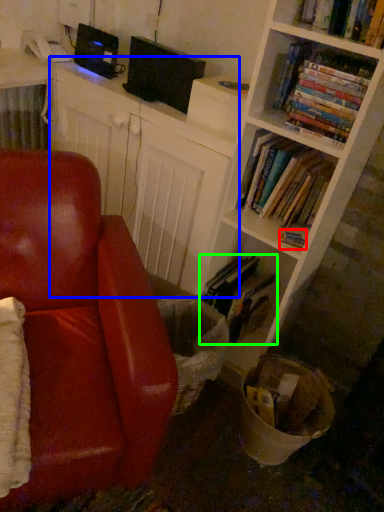
Question: Considering the real-world distances, which object is farthest from book (highlighted by a red box)? computer (highlighted by a blue box) or book (highlighted by a green box)?

Choices:
 (A) computer
 (B) book

Answer: (A)